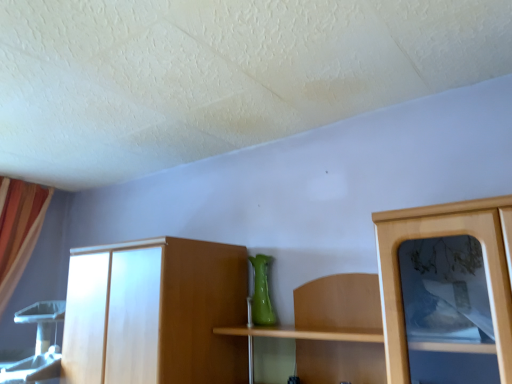
Question: Is green matte vase at center wider or thinner than orange fabric curtain at left?

Choices:
 (A) wide
 (B) thin

Answer: (B)

Question: Based on their sizes in the image, would you say green matte vase at center is bigger or smaller than orange fabric curtain at left?

Choices:
 (A) big
 (B) small

Answer: (B)

Question: Relative to orange fabric curtain at left, is green matte vase at center in front or behind?

Choices:
 (A) front
 (B) behind

Answer: (A)

Question: Is orange fabric curtain at left in front of or behind green matte vase at center in the image?

Choices:
 (A) front
 (B) behind

Answer: (B)

Question: Considering the relative positions of orange fabric curtain at left and green matte vase at center in the image provided, is orange fabric curtain at left to the left or to the right of green matte vase at center?

Choices:
 (A) left
 (B) right

Answer: (A)

Question: In terms of height, does orange fabric curtain at left look taller or shorter compared to green matte vase at center?

Choices:
 (A) short
 (B) tall

Answer: (B)

Question: Choose the correct answer: Is orange fabric curtain at left inside green matte vase at center or outside it?

Choices:
 (A) inside
 (B) outside

Answer: (B)